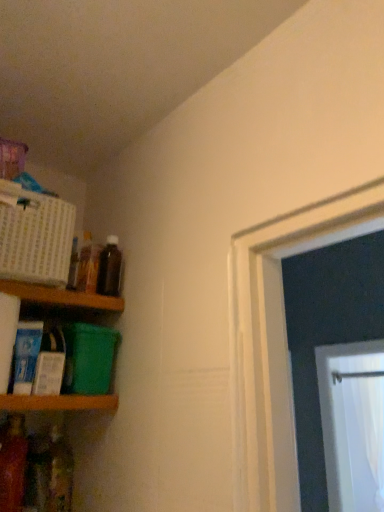
Question: From their relative heights in the image, would you say wooden shelf at lower left, arranged as the second shelf when viewed from the top, is taller or shorter than translucent plastic bottle at lower left, which is the 1th bottle in left-to-right order?

Choices:
 (A) tall
 (B) short

Answer: (B)

Question: From a real-world perspective, is wooden shelf at lower left, arranged as the second shelf when viewed from the top, positioned above or below translucent plastic bottle at lower left, arranged as the fourth bottle when viewed from the right?

Choices:
 (A) above
 (B) below

Answer: (A)

Question: Which object is the closest to the translucent plastic bottle at lower left, arranged as the fourth bottle when viewed from the right?

Choices:
 (A) translucent plastic bottle at lower left, which appears as the 1th bottle when ordered from the bottom
 (B) wooden shelf at left, placed as the second shelf when sorted from bottom to top
 (C) brown glass bottle at upper left, which is the first bottle from top to bottom
 (D) translucent glass bottle at upper left, marked as the third bottle in a bottom-to-top arrangement
 (E) wooden shelf at lower left, placed as the 1th shelf when sorted from bottom to top

Answer: (A)

Question: Which object is positioned closest to the translucent plastic bottle at lower left, the 2th bottle from the left?

Choices:
 (A) wooden shelf at lower left, arranged as the second shelf when viewed from the top
 (B) translucent plastic bottle at lower left, which is the 2th bottle in bottom-to-top order
 (C) brown glass bottle at upper left, which is the 4th bottle in bottom-to-top order
 (D) translucent glass bottle at upper left, placed as the second bottle when sorted from right to left
 (E) wooden shelf at left, which is counted as the 1th shelf, starting from the top

Answer: (B)